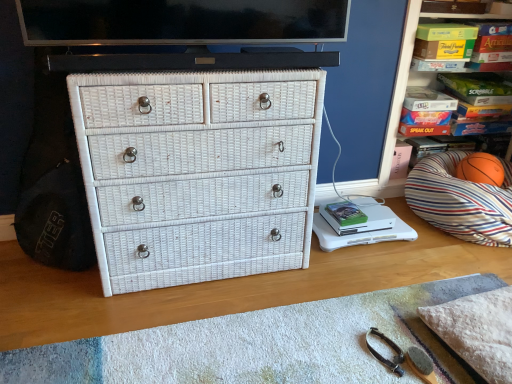
Where is `vacant region to the left of white textured pillow at lower right`? vacant region to the left of white textured pillow at lower right is located at coordinates (393, 332).